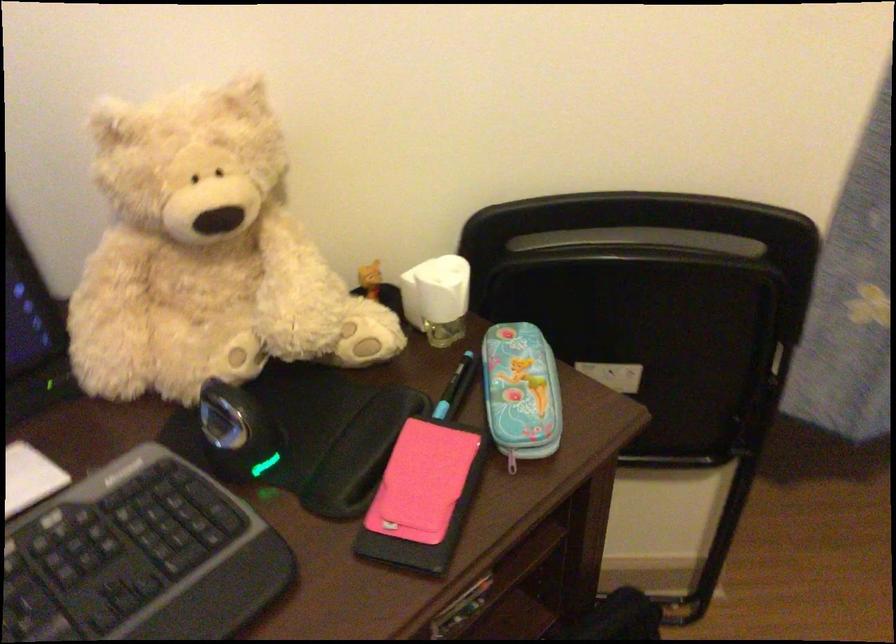
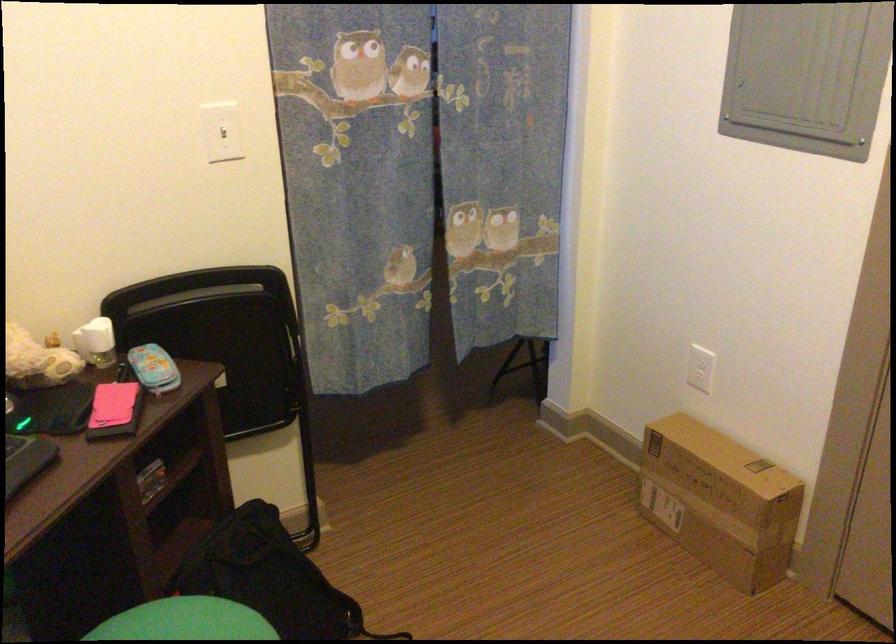
Where in the second image is the point corresponding to point 520,402 from the first image?

(153, 368)